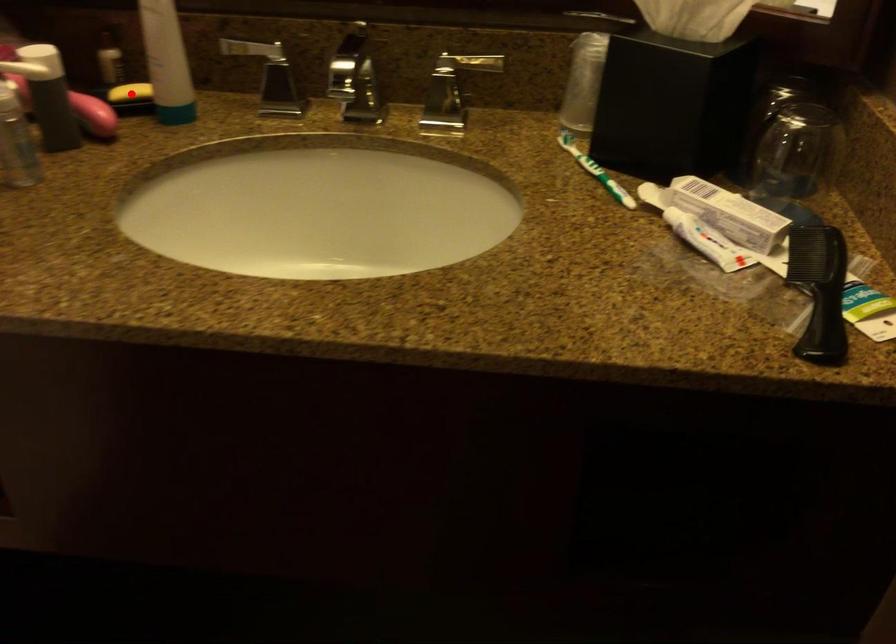
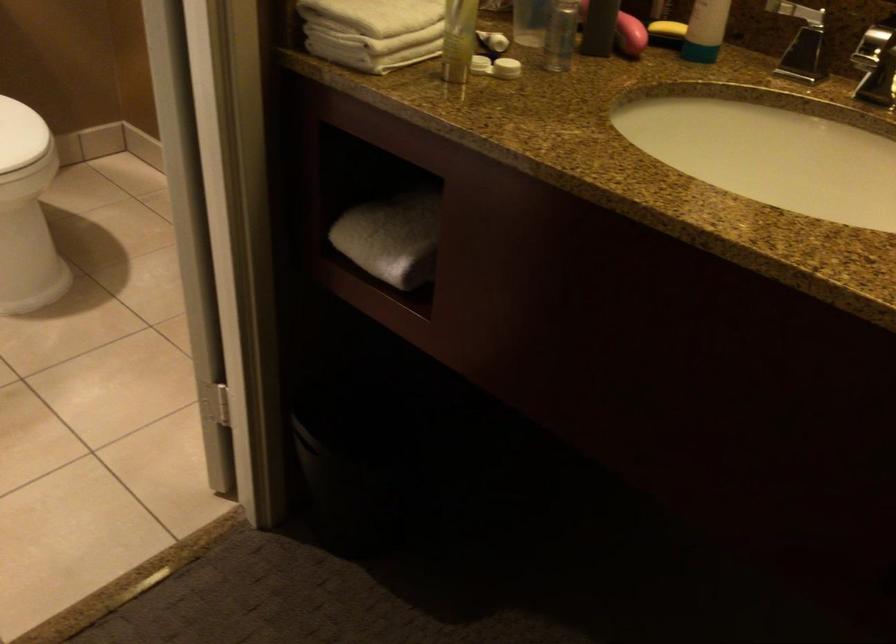
Locate, in the second image, the point that corresponds to the highlighted location in the first image.

(667, 29)